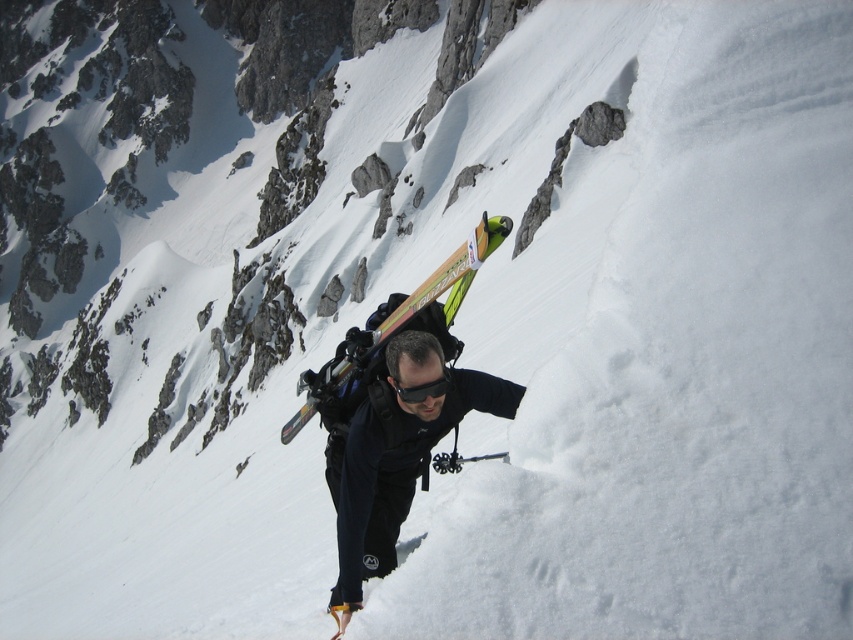
What do you see at coordinates (396, 456) in the screenshot? I see `black matte jacket at center` at bounding box center [396, 456].

Can you confirm if black matte jacket at center is shorter than matte wood ski at center?

Yes, black matte jacket at center is shorter than matte wood ski at center.

This screenshot has height=640, width=853. In order to click on black matte jacket at center in this screenshot , I will do `click(396, 456)`.

This screenshot has width=853, height=640. Identify the location of black matte jacket at center. (396, 456).

Consider the image. Can you confirm if matte wood ski at center is shorter than black matte goggles at center?

No, matte wood ski at center is not shorter than black matte goggles at center.

Does matte wood ski at center have a larger size compared to black matte goggles at center?

Yes, matte wood ski at center is bigger than black matte goggles at center.

Is point (300, 428) less distant than point (431, 384)?

No, (300, 428) is behind (431, 384).

At what (x,y) coordinates should I click in order to perform the action: click on matte wood ski at center. Please return your answer as a coordinate pair (x, y). The height and width of the screenshot is (640, 853). Looking at the image, I should click on (448, 275).

How much distance is there between black matte jacket at center and black matte goggles at center?

black matte jacket at center and black matte goggles at center are 38.92 inches apart from each other.

Does black matte jacket at center appear under black matte goggles at center?

Yes, black matte jacket at center is below black matte goggles at center.

The image size is (853, 640). I want to click on black matte jacket at center, so click(396, 456).